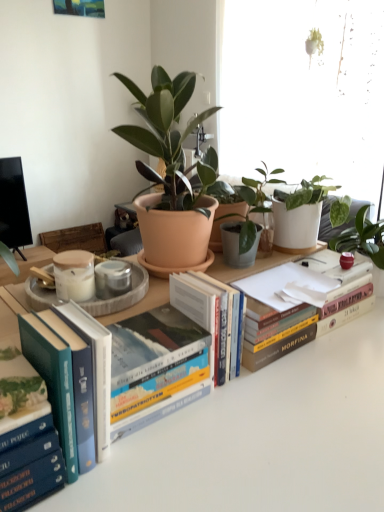
You are a GUI agent. You are given a task and a screenshot of the screen. Output one action in this format:
    pyautogui.click(x=<x>, y=<y>)
    Task: Click on the vacant region above hardcover book at center, placed as the 5th book when sorted from left to right (from a real-world perspective)
    
    Given the screenshot: What is the action you would take?
    pyautogui.click(x=296, y=282)